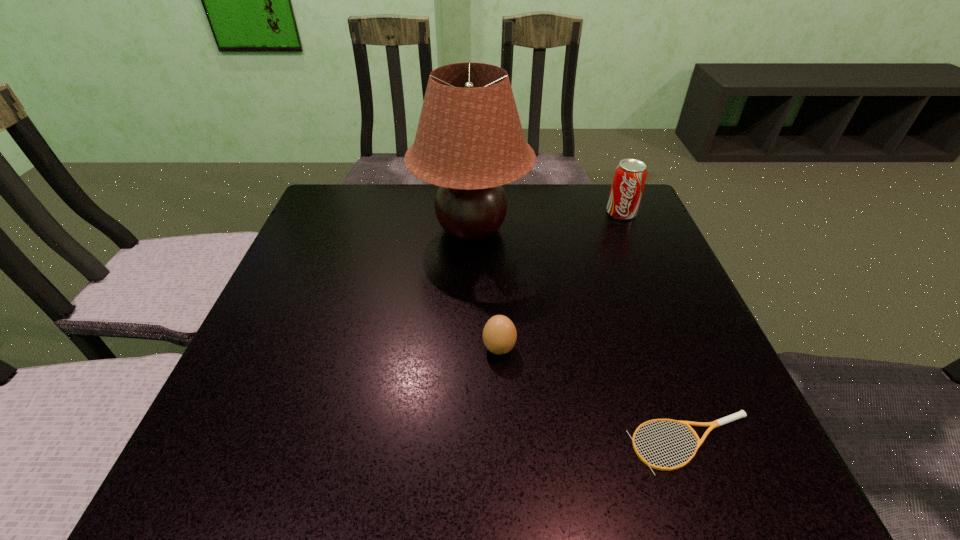
At what (x,y) coordinates should I click in order to perform the action: click on free point that satisfies the following two spatial constraints: 1. on the front-facing side of the lampshade; 2. on the back side of the boiled egg. Please return your answer as a coordinate pair (x, y). The width and height of the screenshot is (960, 540). Looking at the image, I should click on (468, 348).

Where is `free spot that satisfies the following two spatial constraints: 1. on the back side of the soda can; 2. on the right side of the second shortest object`? Image resolution: width=960 pixels, height=540 pixels. free spot that satisfies the following two spatial constraints: 1. on the back side of the soda can; 2. on the right side of the second shortest object is located at coordinates pyautogui.click(x=493, y=213).

The image size is (960, 540). What are the coordinates of `vacant area in the image that satisfies the following two spatial constraints: 1. on the back side of the nearest object; 2. on the front-facing side of the tallest object` in the screenshot? It's located at (612, 229).

Where is `free space that satisfies the following two spatial constraints: 1. on the front-facing side of the second nearest object; 2. on the right side of the lampshade`? The width and height of the screenshot is (960, 540). free space that satisfies the following two spatial constraints: 1. on the front-facing side of the second nearest object; 2. on the right side of the lampshade is located at coordinates point(468,348).